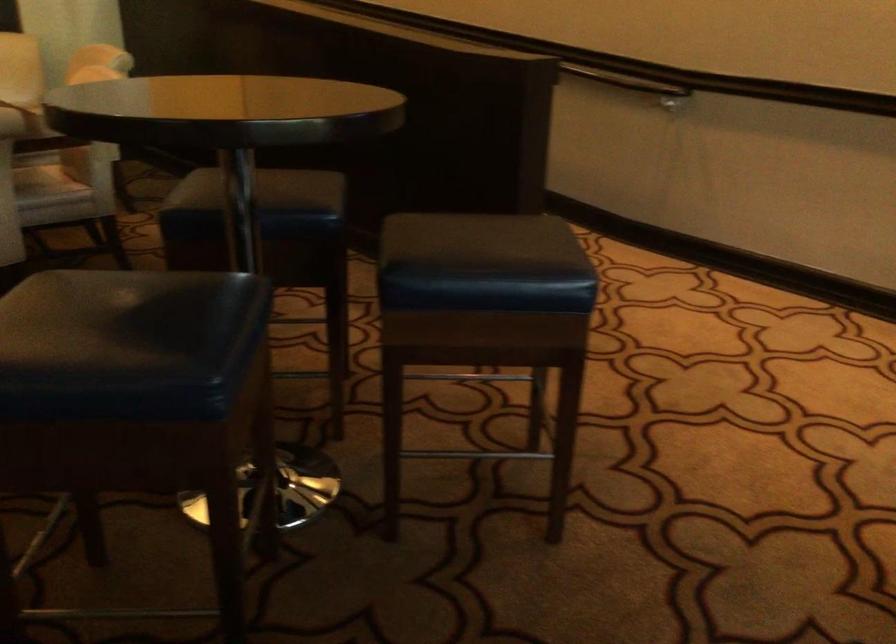
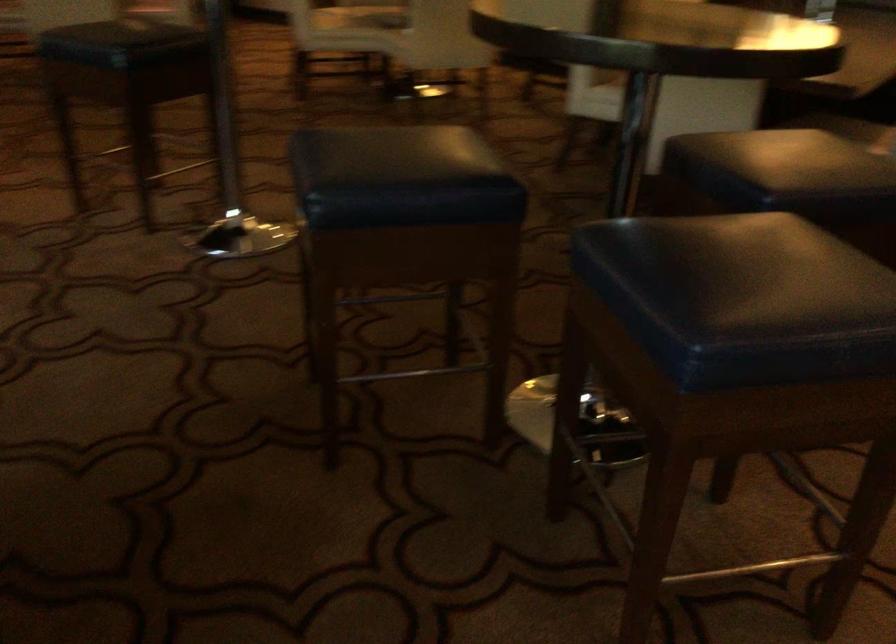
Locate, in the second image, the point that corresponds to pixel 233 310 in the first image.

(401, 178)